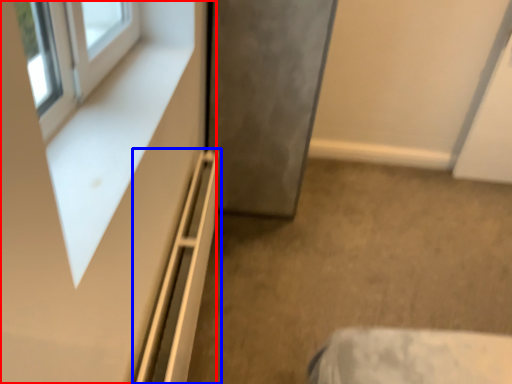
Question: Which object is closer to the camera taking this photo, dresser (highlighted by a red box) or shelf (highlighted by a blue box)?

Choices:
 (A) dresser
 (B) shelf

Answer: (A)